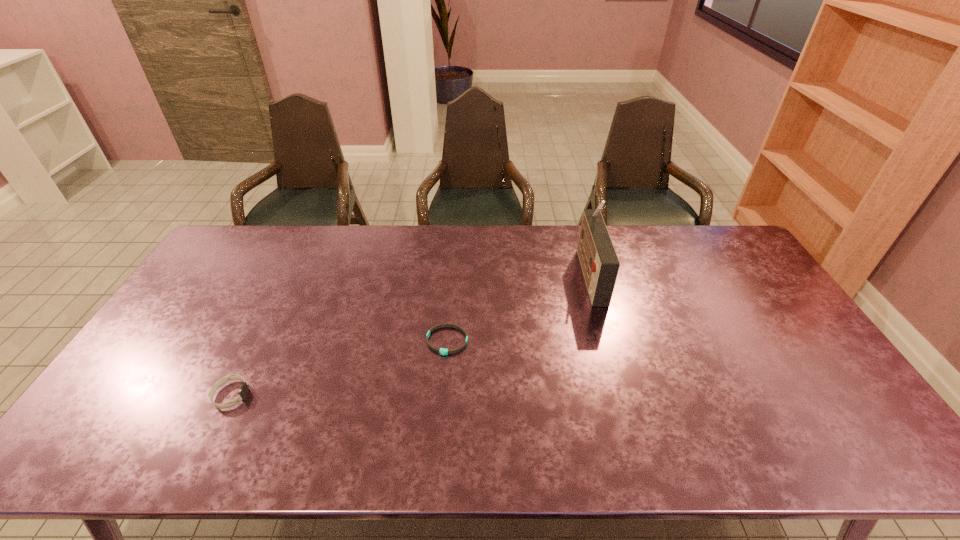
At what (x,y) coordinates should I click in order to perform the action: click on free location that satisfies the following two spatial constraints: 1. on the front panel of the radio receiver; 2. on the buckle of the second object from left to right. Please return your answer as a coordinate pair (x, y). Looking at the image, I should click on (609, 341).

At what (x,y) coordinates should I click in order to perform the action: click on free point that satisfies the following two spatial constraints: 1. on the front panel of the rightmost object; 2. on the buckle of the shortest object. Please return your answer as a coordinate pair (x, y). Looking at the image, I should click on (609, 341).

Identify the location of vacant space that satisfies the following two spatial constraints: 1. on the buckle of the shortest object; 2. on the outer surface of the left wristband. The height and width of the screenshot is (540, 960). (444, 395).

I want to click on free region that satisfies the following two spatial constraints: 1. on the front panel of the tallest object; 2. on the buckle of the second object from right to left, so click(609, 341).

Identify the location of blank area in the image that satisfies the following two spatial constraints: 1. on the buckle of the right wristband; 2. on the outer surface of the left wristband. The image size is (960, 540). (444, 395).